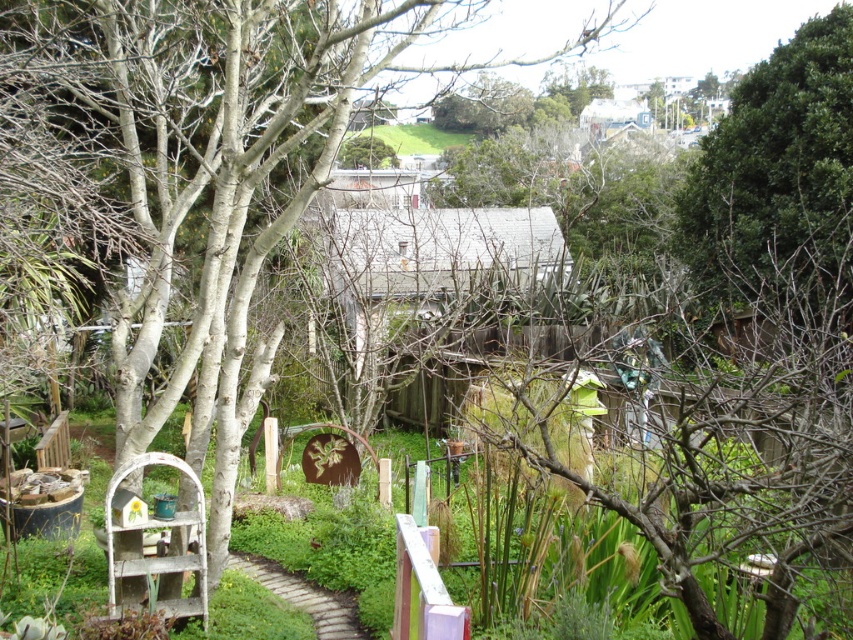
Is green leafy tree at upper right thinner than brown brick path at lower center?

No.

Between green leafy tree at upper right and brown brick path at lower center, which one is positioned lower?

brown brick path at lower center is lower down.

Does point (840, 48) lie behind point (238, 568)?

That is True.

Where is `green leafy tree at upper right`? The image size is (853, 640). green leafy tree at upper right is located at coordinates (780, 184).